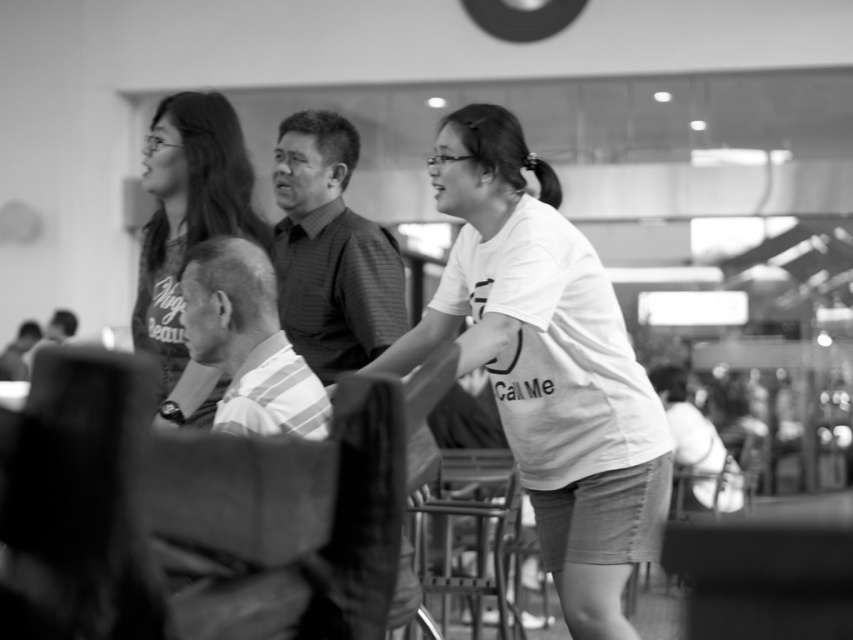
Which is more to the right, striped shirt at center or striped cotton shirt at center?

From the viewer's perspective, striped cotton shirt at center appears more on the right side.

The width and height of the screenshot is (853, 640). Identify the location of striped shirt at center. [329, 252].

Which is behind, point (427, 352) or point (305, 432)?

Point (427, 352)

What do you see at coordinates (544, 364) in the screenshot?
I see `white cotton shirt at center` at bounding box center [544, 364].

Locate an element on the screen. Image resolution: width=853 pixels, height=640 pixels. white cotton shirt at center is located at coordinates (544, 364).

Does white cotton shirt at center have a lesser width compared to matte black shirt at upper left?

In fact, white cotton shirt at center might be wider than matte black shirt at upper left.

Who is more distant from viewer, (544,188) or (193,179)?

Point (544,188)

From the picture: Measure the distance between white cotton shirt at center and camera.

white cotton shirt at center is 9.57 feet from camera.

This screenshot has width=853, height=640. Identify the location of white cotton shirt at center. (544, 364).